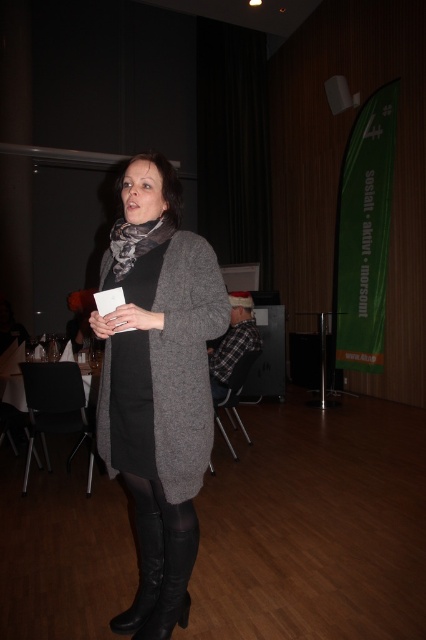
You are a photographer setting up for a photoshoot in the conference room. You need to position a light source between the black matte dress at center and the black leather boot at lower left. Can the light source, which is 18 inches wide, fit in the space between them?

The distance between the black matte dress at center and the black leather boot at lower left is 19.78 inches. Since the light source is 18 inches wide, it can fit in the space between them as there is enough room.

From the picture: You are a photographer setting up for an event. You need to position a light so it illuminates both the black matte dress at center and the black leather boot at lower center. Based on their sizes, which object requires a wider light beam to cover properly?

The black matte dress at center might require a wider light beam since it is wider than the black leather boot at lower center according to the description.

Looking at this image, where is the matte gray cardigan at center located in the image?

The matte gray cardigan at center is located at point (x=158, y=385).